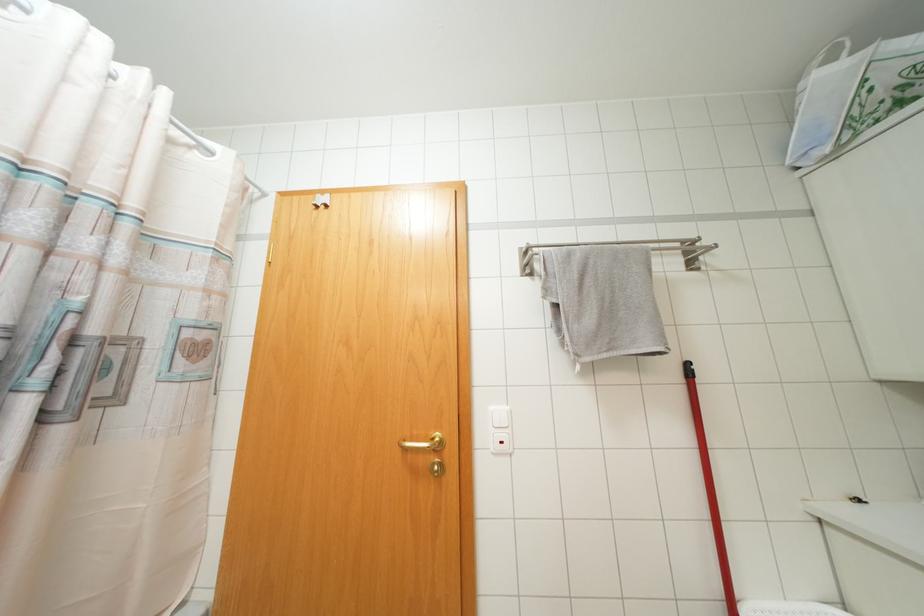
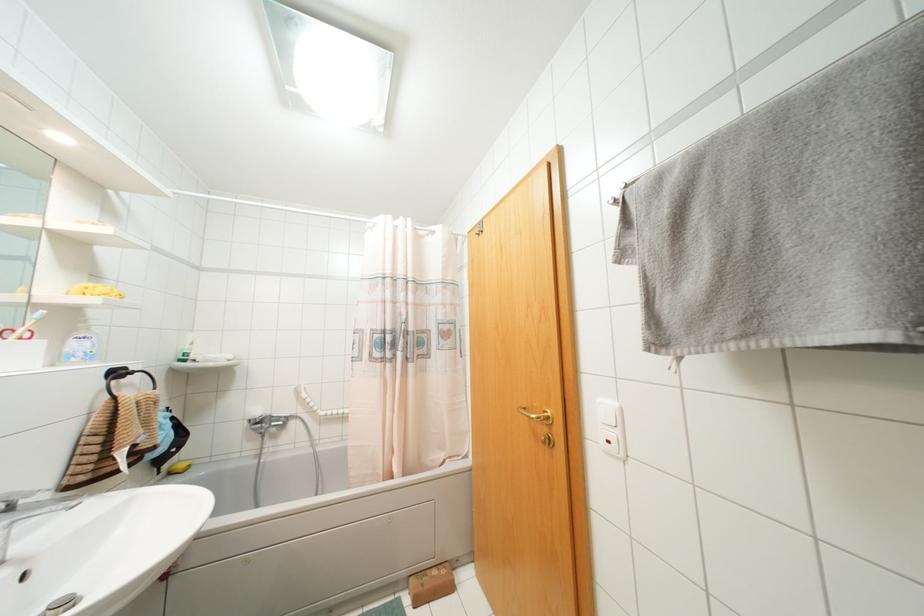
The point at (x=440, y=440) is marked in the first image. Where is the corresponding point in the second image?

(546, 416)